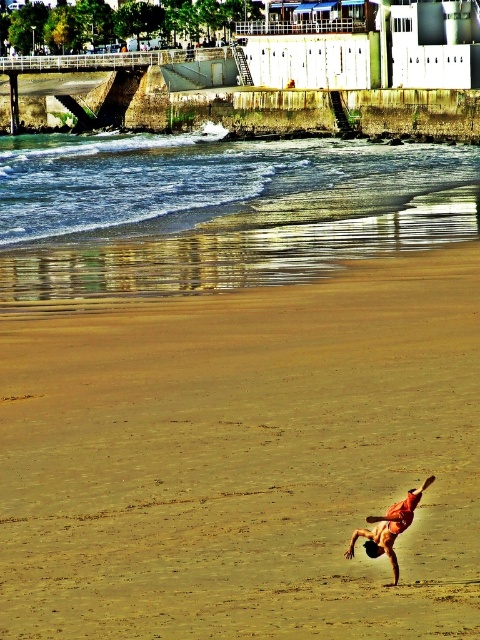
Which is more to the right, brown sandy beach at center or orange fabric gymnast at lower center?

orange fabric gymnast at lower center is more to the right.

Does brown sandy beach at center have a larger size compared to orange fabric gymnast at lower center?

Correct, brown sandy beach at center is larger in size than orange fabric gymnast at lower center.

Find the location of a particular element. brown sandy beach at center is located at coordinates (244, 460).

The height and width of the screenshot is (640, 480). I want to click on brown sandy beach at center, so click(x=244, y=460).